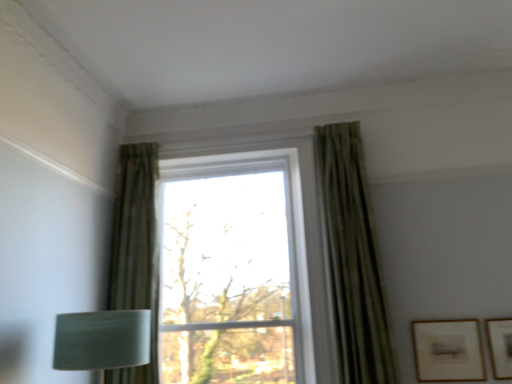
Question: Should I look upward or downward to see matte gold picture frame at lower right, the second picture frame viewed from the right?

Choices:
 (A) down
 (B) up

Answer: (A)

Question: Considering the relative sizes of green textured curtain at left, acting as the second curtain starting from the right, and matte gold picture frame at lower right, arranged as the 1th picture frame when viewed from the right, in the image provided, is green textured curtain at left, acting as the second curtain starting from the right, shorter than matte gold picture frame at lower right, arranged as the 1th picture frame when viewed from the right,?

Choices:
 (A) yes
 (B) no

Answer: (B)

Question: Is green textured curtain at left, marked as the 1th curtain in a left-to-right arrangement, positioned with its back to matte gold picture frame at lower right, positioned as the 2th picture frame in left-to-right order?

Choices:
 (A) no
 (B) yes

Answer: (A)

Question: From the image's perspective, is green textured curtain at left, acting as the second curtain starting from the right, above matte gold picture frame at lower right, arranged as the 1th picture frame when viewed from the right?

Choices:
 (A) no
 (B) yes

Answer: (B)

Question: Can you confirm if green textured curtain at left, marked as the 1th curtain in a left-to-right arrangement, is positioned to the right of matte gold picture frame at lower right, positioned as the 2th picture frame in left-to-right order?

Choices:
 (A) yes
 (B) no

Answer: (B)

Question: Considering the relative sizes of green textured curtain at left, acting as the second curtain starting from the right, and matte gold picture frame at lower right, arranged as the 1th picture frame when viewed from the right, in the image provided, is green textured curtain at left, acting as the second curtain starting from the right, wider than matte gold picture frame at lower right, arranged as the 1th picture frame when viewed from the right,?

Choices:
 (A) yes
 (B) no

Answer: (A)

Question: From the image's perspective, would you say green textured curtain at left, acting as the second curtain starting from the right, is shown under matte gold picture frame at lower right, arranged as the 1th picture frame when viewed from the right?

Choices:
 (A) yes
 (B) no

Answer: (B)

Question: From a real-world perspective, is green textured curtain at upper right, the 2th curtain from the left, on top of transparent glass window at center?

Choices:
 (A) no
 (B) yes

Answer: (B)

Question: Is green textured curtain at upper right, which is the 1th curtain from right to left, taller than transparent glass window at center?

Choices:
 (A) yes
 (B) no

Answer: (B)

Question: Does green textured curtain at upper right, the 2th curtain from the left, come behind transparent glass window at center?

Choices:
 (A) no
 (B) yes

Answer: (A)

Question: Is green textured curtain at upper right, the 2th curtain from the left, at the left side of transparent glass window at center?

Choices:
 (A) no
 (B) yes

Answer: (A)

Question: Considering the relative sizes of green textured curtain at upper right, the 2th curtain from the left, and transparent glass window at center in the image provided, is green textured curtain at upper right, the 2th curtain from the left, smaller than transparent glass window at center?

Choices:
 (A) yes
 (B) no

Answer: (A)

Question: Is green textured curtain at upper right, the 2th curtain from the left, wider than transparent glass window at center?

Choices:
 (A) no
 (B) yes

Answer: (A)

Question: Is matte gold picture frame at lower right, the first picture frame positioned from the left, turned away from transparent glass window at center?

Choices:
 (A) no
 (B) yes

Answer: (A)